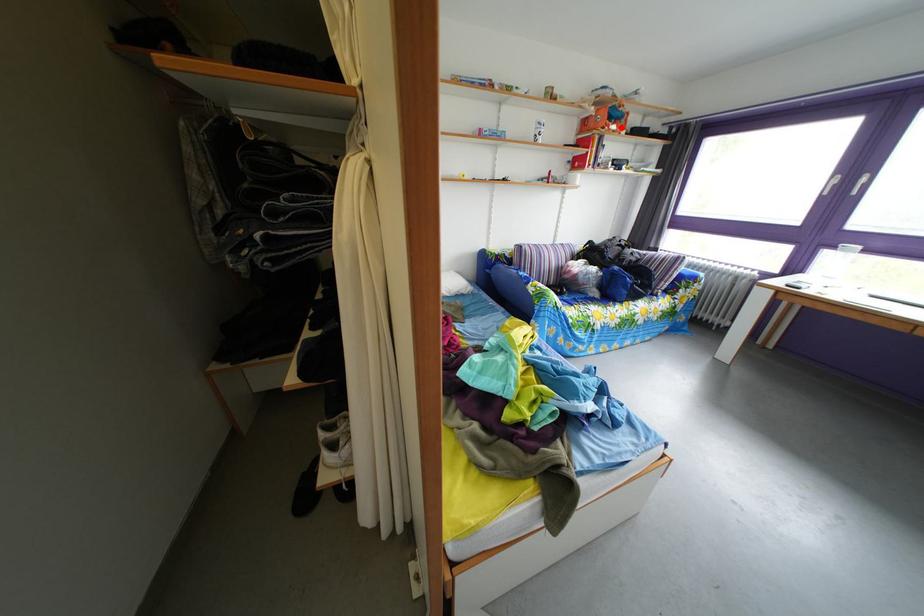
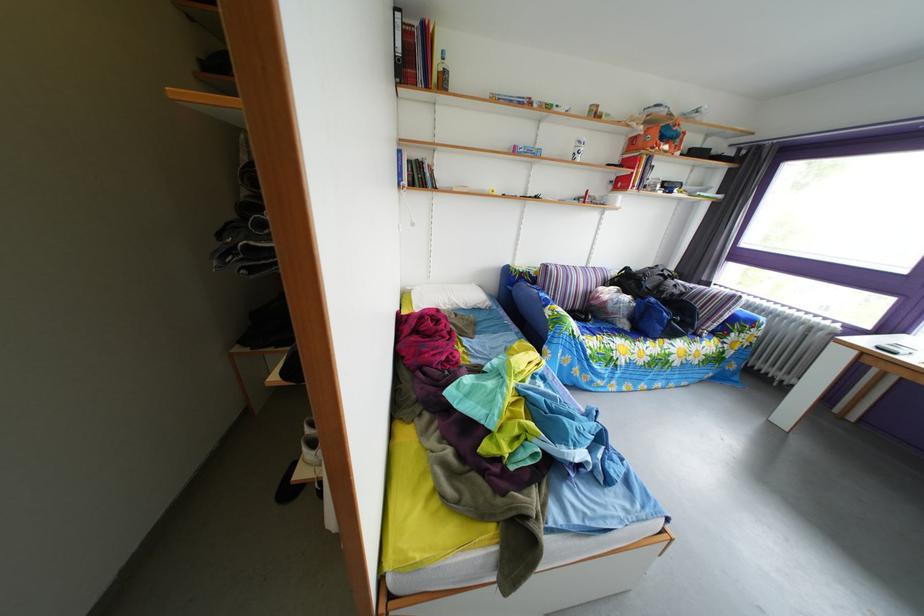
In the second image, find the point that corresponds to the highlighted location in the first image.

(673, 147)